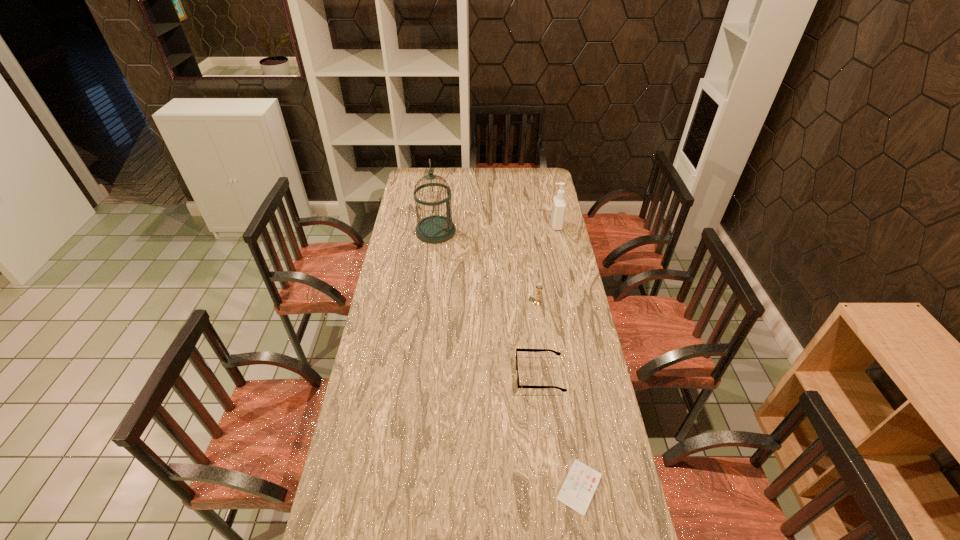
This screenshot has width=960, height=540. I want to click on empty space that is in between the spectacles and the third tallest object, so click(x=539, y=339).

The image size is (960, 540). Identify the location of vacant point located between the leftmost object and the spectacles. (488, 303).

The image size is (960, 540). What are the coordinates of `free space between the candle holder and the cleansing agent` in the screenshot? It's located at (546, 264).

I want to click on free spot between the spectacles and the fourth shortest object, so click(x=548, y=300).

You are a GUI agent. You are given a task and a screenshot of the screen. Output one action in this format:
    pyautogui.click(x=<x>, y=<y>)
    Task: Click on the empty space between the second tallest object and the candle holder
    This screenshot has height=540, width=960.
    Given the screenshot: What is the action you would take?
    pyautogui.click(x=546, y=264)

Find the location of a particular element. This screenshot has width=960, height=540. free space between the candle holder and the shortest object is located at coordinates (559, 394).

I want to click on object that ranks as the second closest to the diary, so pos(538,287).

Locate which object ranks fourth in proximity to the fourth tallest object. Please provide its 2D coordinates. Your answer should be formatted as a tuple, i.e. [(x, y)], where the tuple contains the x and y coordinates of a point satisfying the conditions above.

[(559, 204)]

This screenshot has height=540, width=960. I want to click on vacant space that satisfies the following two spatial constraints: 1. on the front-facing side of the tallest object; 2. on the left side of the shortest object, so click(x=405, y=487).

Find the location of a particular element. vacant area that satisfies the following two spatial constraints: 1. on the front side of the third farthest object; 2. on the arms of the second shortest object is located at coordinates (547, 376).